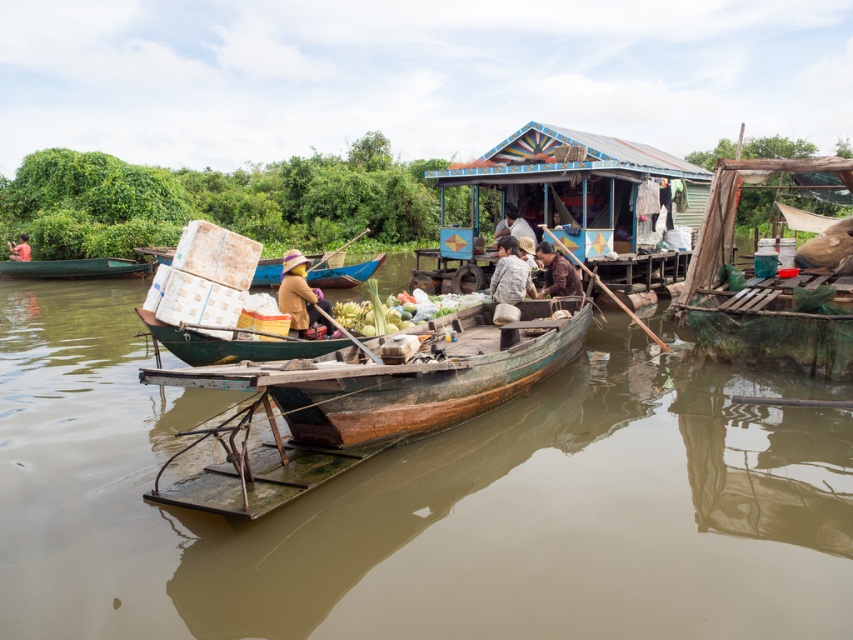
Between wooden boat at center and white fabric at center, which one appears on the right side from the viewer's perspective?

white fabric at center

Is wooden boat at center positioned in front of white fabric at center?

Yes.

Is point (521, 307) positioned after point (503, 227)?

No, it is in front of (503, 227).

Find the location of a particular element. wooden boat at center is located at coordinates (405, 376).

Where is `brown wooden boat at center`? brown wooden boat at center is located at coordinates (422, 502).

Does brown wooden boat at center have a larger size compared to brown fabric person at center?

Yes, brown wooden boat at center is bigger than brown fabric person at center.

Describe the element at coordinates (422, 502) in the screenshot. I see `brown wooden boat at center` at that location.

In order to click on brown wooden boat at center in this screenshot , I will do `click(422, 502)`.

Is green tarpaulin boat at right taller than wooden canoe at center?

Correct, green tarpaulin boat at right is much taller as wooden canoe at center.

Is point (723, 339) positioned in front of point (328, 262)?

Yes.

Find the location of `green tarpaulin boat at right`. green tarpaulin boat at right is located at coordinates (759, 289).